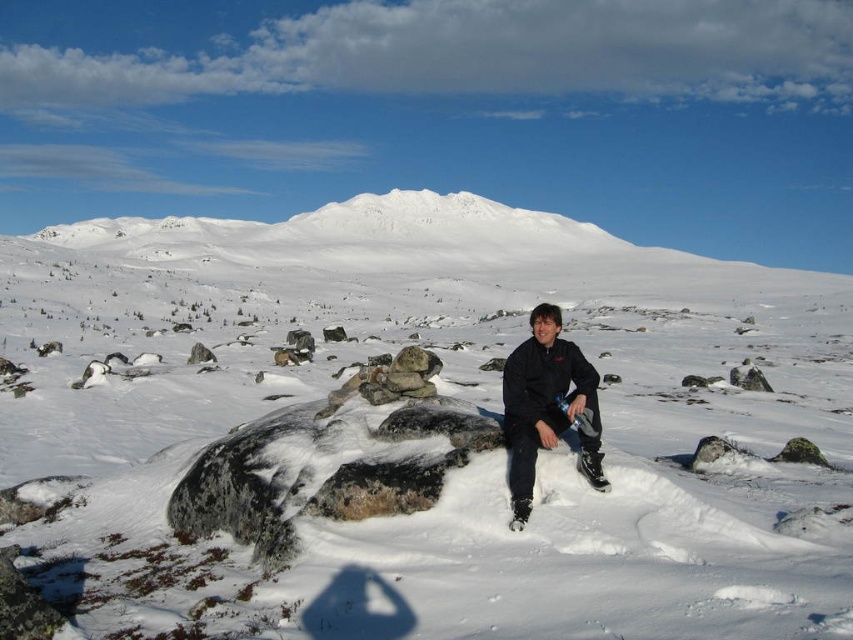
Between white fluffy snow at center and white snow-covered mountain at upper center, which one is positioned lower?

white fluffy snow at center

Is white fluffy snow at center thinner than white snow-covered mountain at upper center?

Correct, white fluffy snow at center's width is less than white snow-covered mountain at upper center's.

This screenshot has height=640, width=853. What are the coordinates of `white fluffy snow at center` in the screenshot? It's located at (432, 436).

Locate an element on the screen. The height and width of the screenshot is (640, 853). white fluffy snow at center is located at coordinates (432, 436).

Measure the distance between white snow-covered mountain at upper center and camera.

white snow-covered mountain at upper center and camera are 222.38 meters apart.

Who is positioned more to the right, white snow-covered mountain at upper center or dark blue jacket at center?

Positioned to the right is dark blue jacket at center.

Is point (422, 192) less distant than point (547, 321)?

No, it is behind (547, 321).

Image resolution: width=853 pixels, height=640 pixels. In order to click on white snow-covered mountain at upper center in this screenshot , I will do `click(431, 252)`.

Between white fluffy snow at center and dark blue jacket at center, which one appears on the right side from the viewer's perspective?

dark blue jacket at center is more to the right.

The height and width of the screenshot is (640, 853). What do you see at coordinates (432, 436) in the screenshot?
I see `white fluffy snow at center` at bounding box center [432, 436].

Identify the location of white fluffy snow at center. The image size is (853, 640). (432, 436).